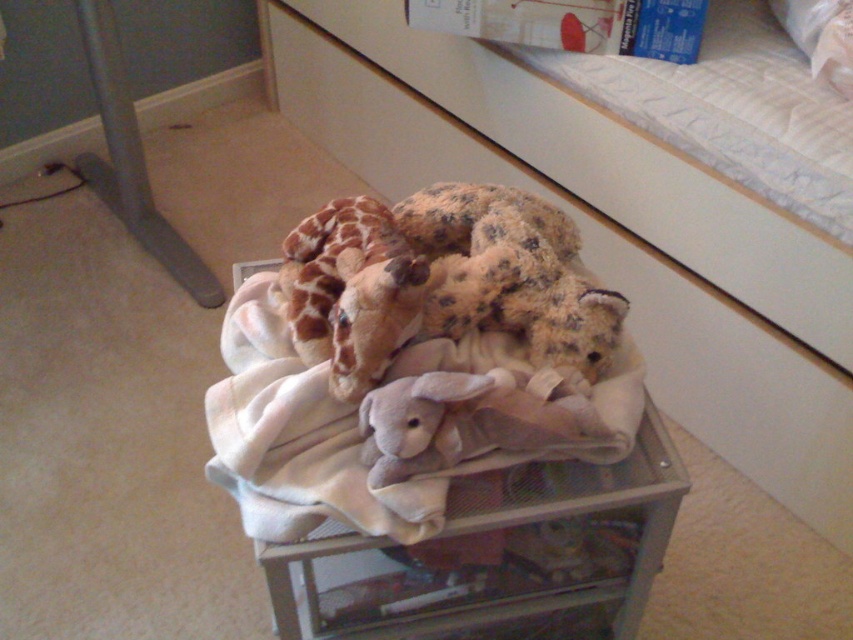
Question: Observing the image, what is the correct spatial positioning of beige fabric dresser at center in reference to fluffy brown teddy bear at center?

Choices:
 (A) right
 (B) left

Answer: (A)

Question: In this image, where is beige fabric dresser at center located relative to fluffy brown teddy bear at center?

Choices:
 (A) below
 (B) above

Answer: (B)

Question: Which object appears farthest from the camera in this image?

Choices:
 (A) gray mesh crate at center
 (B) beige soft blanket at center
 (C) fluffy brown teddy bear at center

Answer: (C)

Question: Which of the following is the closest to the observer?

Choices:
 (A) (349, 538)
 (B) (511, 374)
 (C) (338, 122)
 (D) (554, 304)

Answer: (A)

Question: Which point is closer to the camera?

Choices:
 (A) beige soft blanket at center
 (B) fluffy brown teddy bear at center
 (C) beige fabric dresser at center
 (D) gray mesh crate at center

Answer: (A)

Question: Is gray mesh crate at center in front of fluffy brown teddy bear at center?

Choices:
 (A) no
 (B) yes

Answer: (B)